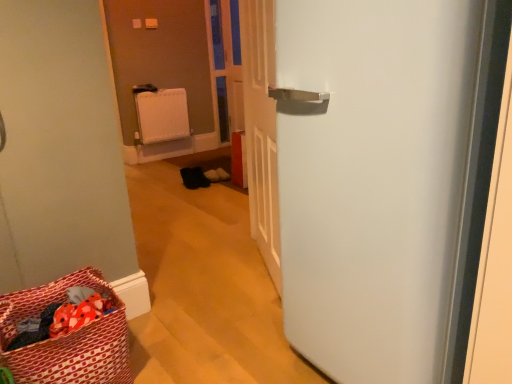
Image resolution: width=512 pixels, height=384 pixels. I want to click on spots to the right of red fabric laundry basket at lower left, so click(x=175, y=351).